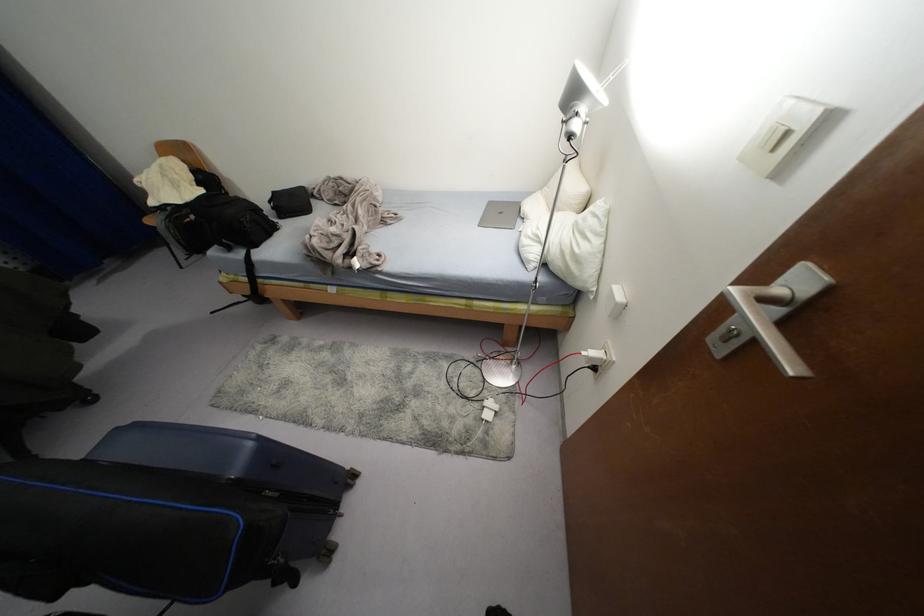
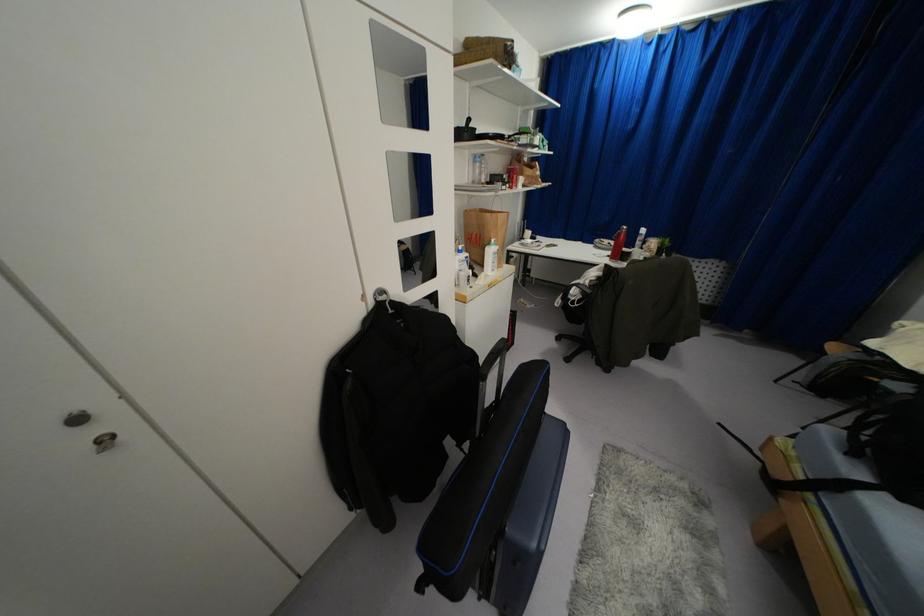
The first image is from the beginning of the video and the second image is from the end. How did the camera likely rotate when shooting the video?

The rotation direction of the camera is left-down.